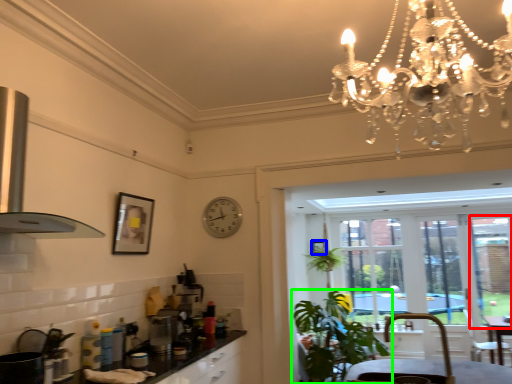
Question: Considering the real-world distances, which object is closest to window screen (highlighted by a red box)? picture frame (highlighted by a blue box) or houseplant (highlighted by a green box).

Choices:
 (A) picture frame
 (B) houseplant

Answer: (A)